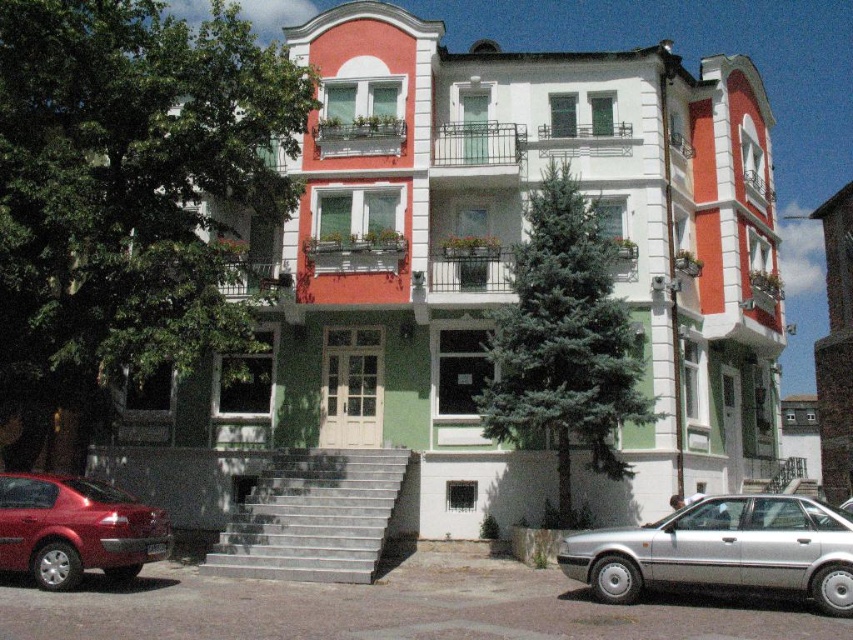
You are standing at the entrance of the residential building and want to park your car, which is 4.5 meters long, in the parking spot near the silver metallic sedan at lower right. Can your car fit in the available space?

The silver metallic sedan at lower right is 14.80 meters away from the viewer. However, the question is about the length of the parking space, not the distance. Since the provided information does not mention the length of the parking space, it is impossible to determine if the car will fit.

You are a delivery person trying to park your 1.8 meters tall delivery box in front of the gray concrete stairs at center. There is a silver metallic sedan at lower right already parked there. Can the delivery box fit between the sedan and the stairs?

The silver metallic sedan at lower right is much taller than the gray concrete stairs at center, but height does not affect the vertical space between them. Since the sedan and stairs are positioned along the same axis, the available space between them might be sufficient for the delivery box. However, without knowing the exact distance between them, it is uncertain if the 1.8 meters tall delivery box can fit.